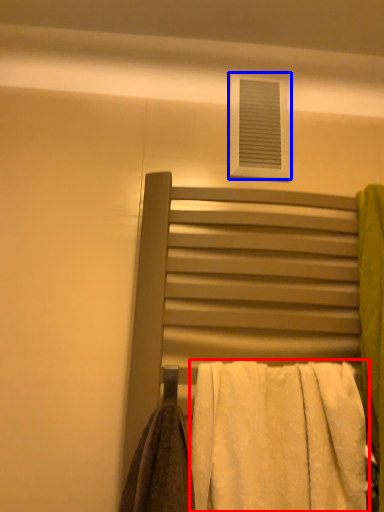
Question: Which point is closer to the camera, towel (highlighted by a red box) or window (highlighted by a blue box)?

Choices:
 (A) towel
 (B) window

Answer: (A)